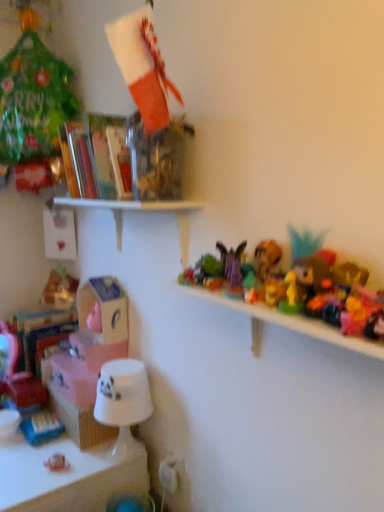
Question: Does purple fabric butterfly at upper center, which ranks as the second toy in back-to-front order, come behind white glossy lampshade at lower left?

Choices:
 (A) no
 (B) yes

Answer: (A)

Question: Is purple fabric butterfly at upper center, the 4th toy viewed from the front, smaller than white glossy lampshade at lower left?

Choices:
 (A) yes
 (B) no

Answer: (A)

Question: Is white glossy lampshade at lower left a part of purple fabric butterfly at upper center, which ranks as the second toy in back-to-front order?

Choices:
 (A) no
 (B) yes

Answer: (A)

Question: From the image's perspective, would you say purple fabric butterfly at upper center, which ranks as the second toy in left-to-right order, is shown under white glossy lampshade at lower left?

Choices:
 (A) no
 (B) yes

Answer: (A)

Question: Is purple fabric butterfly at upper center, which appears as the 2th toy when viewed from the top, completely or partially outside of white glossy lampshade at lower left?

Choices:
 (A) yes
 (B) no

Answer: (A)

Question: From the image's perspective, is multicolored plastic toy at right, marked as the first toy in a right-to-left arrangement, above or below white cardboard box at center-left, the first box when ordered from top to bottom?

Choices:
 (A) above
 (B) below

Answer: (A)

Question: In terms of height, does multicolored plastic toy at right, which is counted as the 3th toy, starting from the front, look taller or shorter compared to white cardboard box at center-left, the first box when ordered from top to bottom?

Choices:
 (A) short
 (B) tall

Answer: (A)

Question: In terms of width, does multicolored plastic toy at right, the fifth toy from the bottom, look wider or thinner when compared to white cardboard box at center-left, the first box when ordered from top to bottom?

Choices:
 (A) wide
 (B) thin

Answer: (B)

Question: Relative to white cardboard box at center-left, the first box when ordered from top to bottom, is multicolored plastic toy at right, the first toy from the top, in front or behind?

Choices:
 (A) behind
 (B) front

Answer: (B)

Question: From a real-world perspective, relative to white glossy cup at lower left, which is the 3th shelf from top to bottom, is shiny plastic toy at center right, marked as the fourth toy in a top-to-bottom arrangement, vertically above or below?

Choices:
 (A) above
 (B) below

Answer: (A)

Question: Does point (271, 294) appear closer or farther from the camera than point (99, 425)?

Choices:
 (A) farther
 (B) closer

Answer: (B)

Question: Considering their positions, is shiny plastic toy at center right, the 2th toy from the bottom, located in front of or behind white glossy cup at lower left, the first shelf when ordered from bottom to top?

Choices:
 (A) behind
 (B) front

Answer: (B)

Question: Is shiny plastic toy at center right, marked as the fourth toy in a top-to-bottom arrangement, inside the boundaries of white glossy cup at lower left, which is the 3th shelf from top to bottom, or outside?

Choices:
 (A) outside
 (B) inside

Answer: (A)

Question: In the image, is shiny plastic toy at center right, the second toy in the right-to-left sequence, on the left side or the right side of translucent plastic books at upper left, marked as the 3th shelf in a bottom-to-top arrangement?

Choices:
 (A) left
 (B) right

Answer: (B)

Question: From their relative heights in the image, would you say shiny plastic toy at center right, marked as the 4th toy in a left-to-right arrangement, is taller or shorter than translucent plastic books at upper left, which is the first shelf in top-to-bottom order?

Choices:
 (A) short
 (B) tall

Answer: (A)